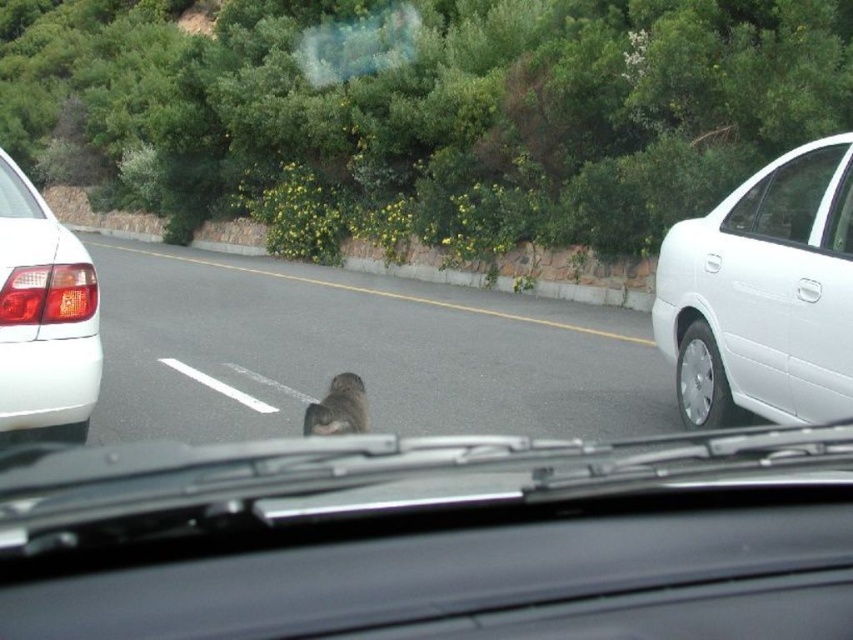
Between furry gray animal at center and black plastic license plate at center, which one appears on the right side from the viewer's perspective?

furry gray animal at center is more to the right.

From the picture: Who is more distant from viewer, (354, 412) or (61, 317)?

The point (354, 412) is more distant.

Measure the distance between furry gray animal at center and camera.

4.15 meters

You are a GUI agent. You are given a task and a screenshot of the screen. Output one action in this format:
    pyautogui.click(x=<x>, y=<y>)
    Task: Click on the furry gray animal at center
    The image size is (853, 640).
    Given the screenshot: What is the action you would take?
    pyautogui.click(x=338, y=408)

Image resolution: width=853 pixels, height=640 pixels. What do you see at coordinates (357, 353) in the screenshot? I see `gray asphalt road at center` at bounding box center [357, 353].

Can you confirm if gray asphalt road at center is taller than white metallic car at right?

Answer: Incorrect, gray asphalt road at center's height is not larger of white metallic car at right's.

You are a GUI agent. You are given a task and a screenshot of the screen. Output one action in this format:
    pyautogui.click(x=<x>, y=<y>)
    Task: Click on the gray asphalt road at center
    
    Given the screenshot: What is the action you would take?
    pyautogui.click(x=357, y=353)

Who is positioned more to the right, white metallic car at right or transparent glass windshield at upper left?

white metallic car at right

Does point (796, 349) lie behind point (0, 156)?

No, it is in front of (0, 156).

You are a GUI agent. You are given a task and a screenshot of the screen. Output one action in this format:
    pyautogui.click(x=<x>, y=<y>)
    Task: Click on the white metallic car at right
    This screenshot has height=640, width=853.
    Given the screenshot: What is the action you would take?
    pyautogui.click(x=764, y=294)